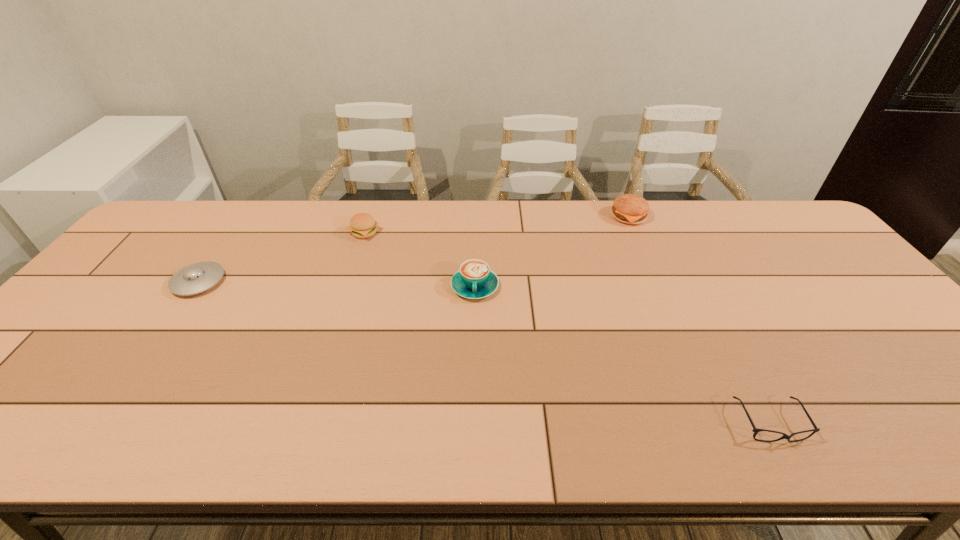
In the image, there is a desktop. Where is `blank space at the far edge`? The image size is (960, 540). blank space at the far edge is located at coordinates point(418,215).

Locate an element on the screen. vacant space at the left edge of the desktop is located at coordinates (88, 307).

The width and height of the screenshot is (960, 540). I want to click on blank space at the right edge, so click(895, 356).

Identify the location of blank area at the far right corner. The height and width of the screenshot is (540, 960). (778, 208).

Where is `unoccupied position between the nearest object and the right hamburger`? This screenshot has width=960, height=540. unoccupied position between the nearest object and the right hamburger is located at coordinates (699, 320).

Image resolution: width=960 pixels, height=540 pixels. What are the coordinates of `empty location between the leftmost object and the left hamburger` in the screenshot? It's located at (281, 257).

Find the location of a particular element. The height and width of the screenshot is (540, 960). free space between the spectacles and the third object from left to right is located at coordinates (622, 355).

Find the location of a particular element. This screenshot has height=540, width=960. empty space that is in between the spectacles and the right hamburger is located at coordinates (699, 320).

Image resolution: width=960 pixels, height=540 pixels. I want to click on empty space that is in between the leftmost object and the third object from left to right, so click(337, 284).

The height and width of the screenshot is (540, 960). What are the coordinates of `free space between the spectacles and the right hamburger` in the screenshot? It's located at (699, 320).